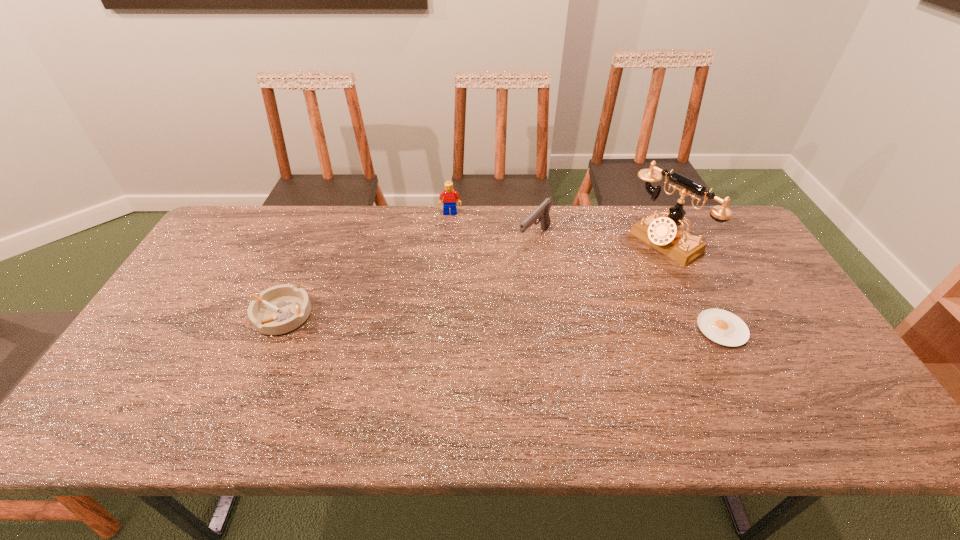
Image resolution: width=960 pixels, height=540 pixels. Identify the location of the second shortest object. (280, 309).

Find the location of a particular element. The height and width of the screenshot is (540, 960). the leftmost object is located at coordinates (x=280, y=309).

The image size is (960, 540). Find the location of `egg yolk`. egg yolk is located at coordinates (723, 327).

Where is `the third object from left to right`? the third object from left to right is located at coordinates (542, 212).

Locate an element on the screen. the fourth object from right to left is located at coordinates (449, 196).

Find the location of a particular element. The width and height of the screenshot is (960, 540). Lego is located at coordinates (449, 196).

You are a GUI agent. You are given a task and a screenshot of the screen. Output one action in this format:
    pyautogui.click(x=<x>, y=<y>)
    Task: Click on the tallest object
    This screenshot has height=540, width=960.
    Given the screenshot: What is the action you would take?
    click(666, 234)

Where is `free space located on the back of the ashtray`? This screenshot has height=540, width=960. free space located on the back of the ashtray is located at coordinates (312, 245).

Where is `free space located 0.300m on the back of the egg yolk`? Image resolution: width=960 pixels, height=540 pixels. free space located 0.300m on the back of the egg yolk is located at coordinates (678, 241).

Find the location of `free location located at the barrel of the third object from right to left`. free location located at the barrel of the third object from right to left is located at coordinates (496, 284).